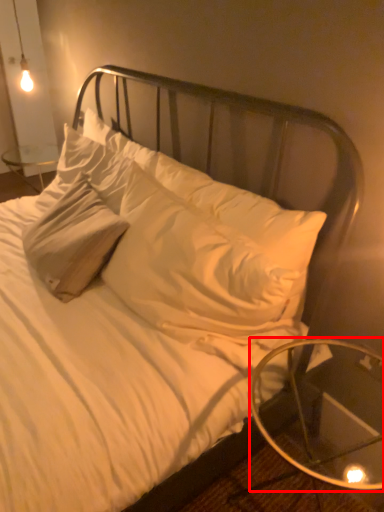
Question: From the image's perspective, what is the correct spatial positioning of table (annotated by the red box) in reference to pillow?

Choices:
 (A) above
 (B) below

Answer: (B)